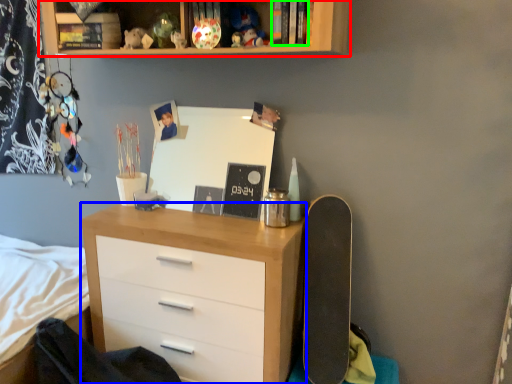
Question: Based on their relative distances, which object is farther from shelf (highlighted by a red box)? Choose from chest of drawers (highlighted by a blue box) and book (highlighted by a green box).

Choices:
 (A) chest of drawers
 (B) book

Answer: (A)